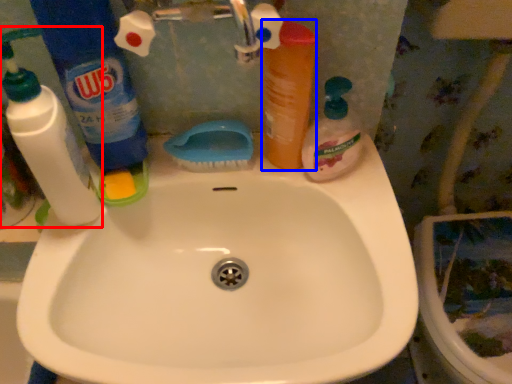
Question: Which object appears farthest to the camera in this image, cleaning product (highlighted by a red box) or mouthwash (highlighted by a blue box)?

Choices:
 (A) cleaning product
 (B) mouthwash

Answer: (B)